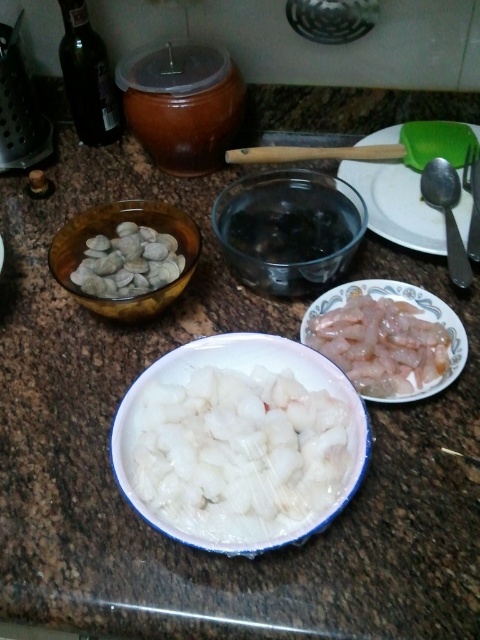
Is white translucent cubes at center positioned at the back of white glossy shellfish at left?

No.

Can you confirm if white translucent cubes at center is thinner than white glossy shellfish at left?

Incorrect, white translucent cubes at center's width is not less than white glossy shellfish at left's.

Does point (172, 490) lie behind point (156, 282)?

No, it is not.

Locate an element on the screen. The width and height of the screenshot is (480, 640). white translucent cubes at center is located at coordinates (239, 452).

Who is positioned more to the right, translucent white shrimp at right or white glossy shellfish at left?

Positioned to the right is translucent white shrimp at right.

Can you confirm if translucent white shrimp at right is bigger than white glossy shellfish at left?

Correct, translucent white shrimp at right is larger in size than white glossy shellfish at left.

Between point (304, 337) and point (99, 289), which one is positioned behind?

Positioned behind is point (99, 289).

What are the coordinates of `translucent white shrimp at right` in the screenshot? It's located at (381, 344).

Does white translucent cubes at center appear over satin silver spoon at right?

No.

Does white translucent cubes at center appear under satin silver spoon at right?

Correct, white translucent cubes at center is located below satin silver spoon at right.

Which is behind, point (168, 436) or point (425, 182)?

The point (425, 182) is more distant.

Locate an element on the screen. The height and width of the screenshot is (640, 480). white translucent cubes at center is located at coordinates [x=239, y=452].